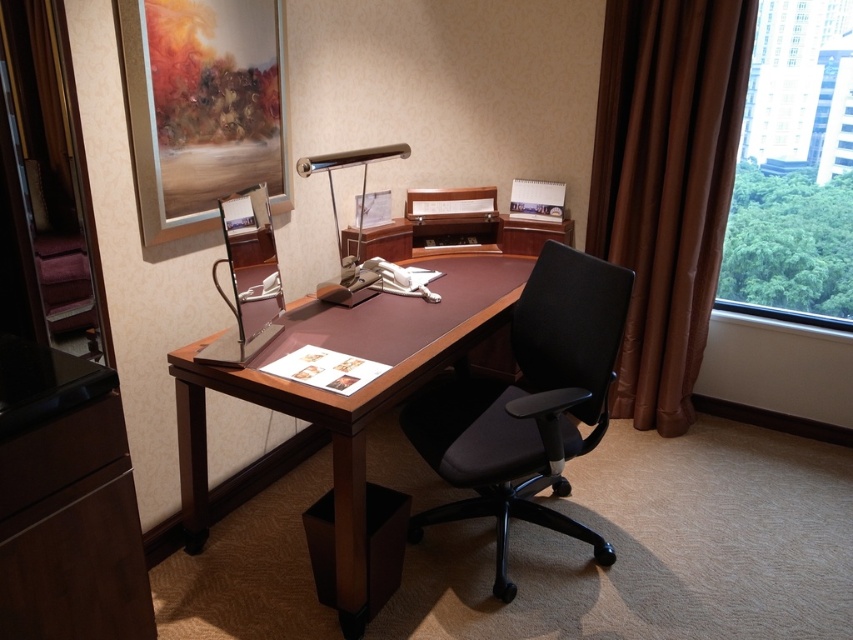
Question: Which object is farther from the camera taking this photo?

Choices:
 (A) transparent glass window at right
 (B) brown velvet curtain at right
 (C) brown wood desk at center
 (D) black fabric swivel chair at center

Answer: (A)

Question: Is the position of brown velvet curtain at right less distant than that of satin silver desk lamp at center?

Choices:
 (A) no
 (B) yes

Answer: (A)

Question: In this image, where is brown velvet curtain at right located relative to satin silver desk lamp at center?

Choices:
 (A) above
 (B) below

Answer: (B)

Question: Does brown wood desk at center appear on the left side of satin silver desk lamp at center?

Choices:
 (A) yes
 (B) no

Answer: (B)

Question: Estimate the real-world distances between objects in this image. Which object is closer to the satin silver desk lamp at center?

Choices:
 (A) brown matte drawer at lower left
 (B) brown velvet curtain at right
 (C) brown wood desk at center
 (D) black fabric swivel chair at center

Answer: (C)

Question: Which object is farther from the camera taking this photo?

Choices:
 (A) transparent glass window at right
 (B) brown wood desk at center
 (C) satin silver desk lamp at center

Answer: (A)